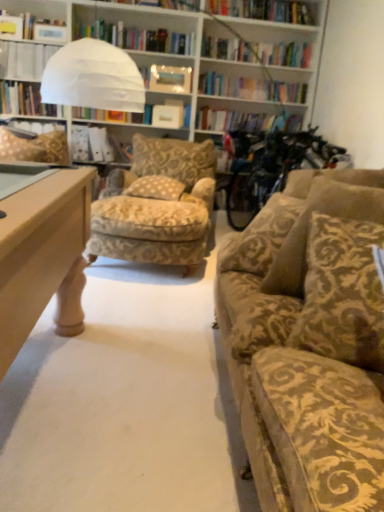
Where is `empty space that is ontop of white paper at upper left, marked as the first book in a left-to-right arrangement (from a real-world perspective)`? empty space that is ontop of white paper at upper left, marked as the first book in a left-to-right arrangement (from a real-world perspective) is located at coordinates (31, 39).